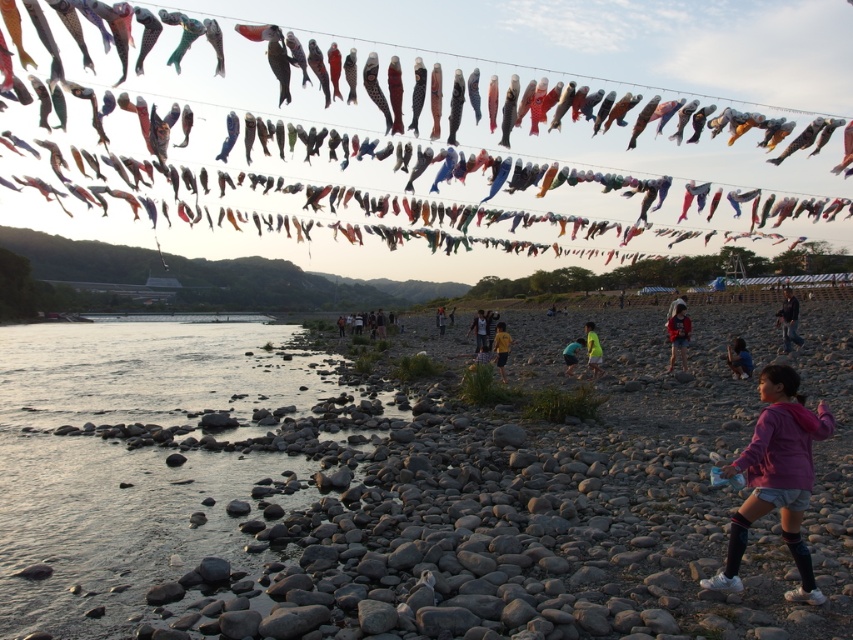
Question: Can you confirm if pink fabric at center is thinner than dark blue shirt at center?

Choices:
 (A) no
 (B) yes

Answer: (B)

Question: Does colorful fabric kites at upper center have a smaller size compared to yellow fabric person at center?

Choices:
 (A) no
 (B) yes

Answer: (A)

Question: Among these points, which one is nearest to the camera?

Choices:
 (A) (564, 349)
 (B) (392, 314)
 (C) (440, 44)

Answer: (A)

Question: Estimate the real-world distances between objects in this image. Which object is closer to the purple fleece jacket at lower right?

Choices:
 (A) yellow fabric person at center
 (B) dark blue shirt at center
 (C) blue denim jeans at center
 (D) dark blue jacket at lower right

Answer: (A)

Question: Among these points, which one is nearest to the camera?

Choices:
 (A) (772, 493)
 (B) (480, 316)
 (C) (595, 376)

Answer: (A)

Question: Does yellow fabric person at center have a lesser width compared to dark blue shirt at center?

Choices:
 (A) no
 (B) yes

Answer: (B)